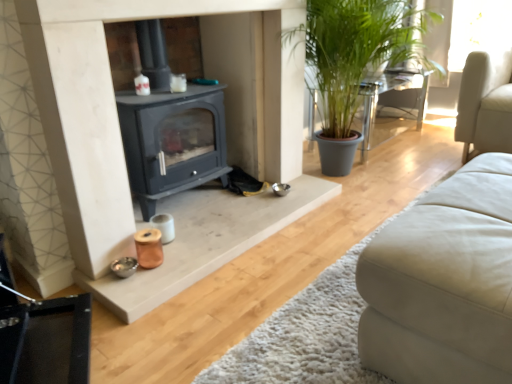
The width and height of the screenshot is (512, 384). Describe the element at coordinates (444, 283) in the screenshot. I see `white leather studio couch at lower right` at that location.

At what (x,y) coordinates should I click in order to perform the action: click on white leather studio couch at lower right. Please return your answer as a coordinate pair (x, y). The width and height of the screenshot is (512, 384). Looking at the image, I should click on (444, 283).

This screenshot has width=512, height=384. Describe the element at coordinates (391, 107) in the screenshot. I see `green leafy plant at right` at that location.

Where is `green leafy plant at right`? This screenshot has height=384, width=512. green leafy plant at right is located at coordinates (391, 107).

Locate an element on the screen. white leather studio couch at lower right is located at coordinates (444, 283).

Considering the positions of objects white leather studio couch at lower right and green leafy plant at right in the image provided, who is more to the right, white leather studio couch at lower right or green leafy plant at right?

green leafy plant at right.

Between white leather studio couch at lower right and green leafy plant at right, which one is positioned in front?

Positioned in front is white leather studio couch at lower right.

Which is in front, point (383, 364) or point (410, 129)?

Point (383, 364)

From the image's perspective, between white leather studio couch at lower right and green leafy plant at right, who is located below?

white leather studio couch at lower right appears lower in the image.

From a real-world perspective, is white leather studio couch at lower right under green leafy plant at right?

No, from a real-world perspective, white leather studio couch at lower right is not below green leafy plant at right.

Considering the sizes of objects white leather studio couch at lower right and green leafy plant at right in the image provided, who is wider, white leather studio couch at lower right or green leafy plant at right?

white leather studio couch at lower right is wider.

Is white leather studio couch at lower right shorter than green leafy plant at right?

Yes.

Considering the relative sizes of white leather studio couch at lower right and green leafy plant at right in the image provided, is white leather studio couch at lower right bigger than green leafy plant at right?

Actually, white leather studio couch at lower right might be smaller than green leafy plant at right.

Is white leather studio couch at lower right completely or partially outside of green leafy plant at right?

white leather studio couch at lower right is positioned outside green leafy plant at right.

Would you consider white leather studio couch at lower right to be distant from green leafy plant at right?

white leather studio couch at lower right is far away from green leafy plant at right.

Is white leather studio couch at lower right looking in the opposite direction of green leafy plant at right?

No, green leafy plant at right is not at the back of white leather studio couch at lower right.

Identify the location of table behind the white leather studio couch at lower right. This screenshot has height=384, width=512. pyautogui.click(x=391, y=107).

Would you say green leafy plant at right is to the left or to the right of white leather studio couch at lower right in the picture?

Clearly, green leafy plant at right is on the right of white leather studio couch at lower right in the image.

Does green leafy plant at right lie behind white leather studio couch at lower right?

Yes, the depth of green leafy plant at right is greater than that of white leather studio couch at lower right.

Does point (392, 112) come closer to viewer compared to point (449, 271)?

No, it is not.

From the image's perspective, relative to white leather studio couch at lower right, is green leafy plant at right above or below?

Based on their image positions, green leafy plant at right is located above white leather studio couch at lower right.

From a real-world perspective, is green leafy plant at right positioned above or below white leather studio couch at lower right?

From a real-world perspective, green leafy plant at right is physically below white leather studio couch at lower right.

Can you confirm if green leafy plant at right is thinner than white leather studio couch at lower right?

Indeed, green leafy plant at right has a lesser width compared to white leather studio couch at lower right.

Considering the sizes of objects green leafy plant at right and white leather studio couch at lower right in the image provided, who is taller, green leafy plant at right or white leather studio couch at lower right?

green leafy plant at right is taller.

Which of these two, green leafy plant at right or white leather studio couch at lower right, is bigger?

Bigger between the two is green leafy plant at right.

Does green leafy plant at right contain white leather studio couch at lower right?

No, white leather studio couch at lower right is not a part of green leafy plant at right.

Is green leafy plant at right beside white leather studio couch at lower right?

They are not placed beside each other.

Is white leather studio couch at lower right at the back of green leafy plant at right?

No, white leather studio couch at lower right is not at the back of green leafy plant at right.

What's the angular difference between green leafy plant at right and white leather studio couch at lower right's facing directions?

They differ by 93.5 degrees in their facing directions.

Find the location of a particular element. This screenshot has height=384, width=512. studio couch that is in front of the green leafy plant at right is located at coordinates (444, 283).

Locate an element on the screen. The height and width of the screenshot is (384, 512). studio couch on the left side of green leafy plant at right is located at coordinates (444, 283).

The height and width of the screenshot is (384, 512). What are the coordinates of `table on the right of white leather studio couch at lower right` in the screenshot? It's located at (391, 107).